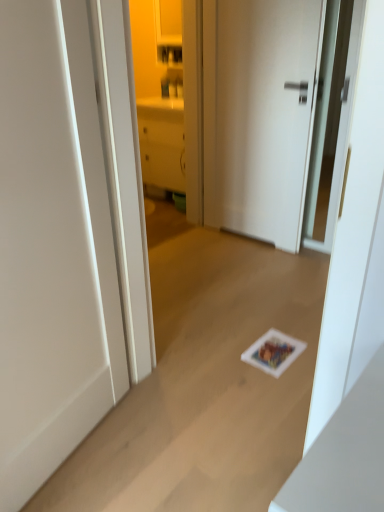
Question: In which direction should I rotate to look at white matte door at center, which is the 2th door from back to front?

Choices:
 (A) right
 (B) left

Answer: (B)

Question: Is matte white cabinet at center inside white matte door at center, the second door in the front-to-back sequence?

Choices:
 (A) yes
 (B) no

Answer: (B)

Question: Is white matte door at center, the 1th door when ordered from back to front, taller than matte white cabinet at center?

Choices:
 (A) no
 (B) yes

Answer: (A)

Question: Does white matte door at center, which is the first door from right to left, have a greater width compared to matte white cabinet at center?

Choices:
 (A) yes
 (B) no

Answer: (B)

Question: From the image's perspective, is white matte door at center, the second door when ordered from left to right, under matte white cabinet at center?

Choices:
 (A) yes
 (B) no

Answer: (A)

Question: From a real-world perspective, is white matte door at center, which is the first door from right to left, over matte white cabinet at center?

Choices:
 (A) no
 (B) yes

Answer: (A)

Question: Is the depth of white matte door at center, the second door in the front-to-back sequence, greater than that of matte white cabinet at center?

Choices:
 (A) yes
 (B) no

Answer: (B)

Question: Is white matte door at center, which is the first door from right to left, located within white matte door at center, acting as the second door starting from the right?

Choices:
 (A) no
 (B) yes

Answer: (A)

Question: From the image's perspective, is white matte door at center, acting as the second door starting from the right, over white matte door at center, the second door when ordered from left to right?

Choices:
 (A) no
 (B) yes

Answer: (A)

Question: Are white matte door at center, the first door from the front, and white matte door at center, which is the first door from right to left, making contact?

Choices:
 (A) yes
 (B) no

Answer: (B)

Question: Is white matte door at center, the 1th door viewed from the left, located outside white matte door at center, the second door in the front-to-back sequence?

Choices:
 (A) yes
 (B) no

Answer: (A)

Question: Considering the relative sizes of white matte door at center, which is the 2th door from back to front, and white matte door at center, which is the first door from right to left, in the image provided, is white matte door at center, which is the 2th door from back to front, taller than white matte door at center, which is the first door from right to left,?

Choices:
 (A) no
 (B) yes

Answer: (A)

Question: From the image's perspective, is white matte door at center, the 1th door viewed from the left, below white matte door at center, the second door when ordered from left to right?

Choices:
 (A) yes
 (B) no

Answer: (A)

Question: Are white matte door at center, which is the first door from right to left, and white matte door at center, which is the 2th door from back to front, located far from each other?

Choices:
 (A) yes
 (B) no

Answer: (A)